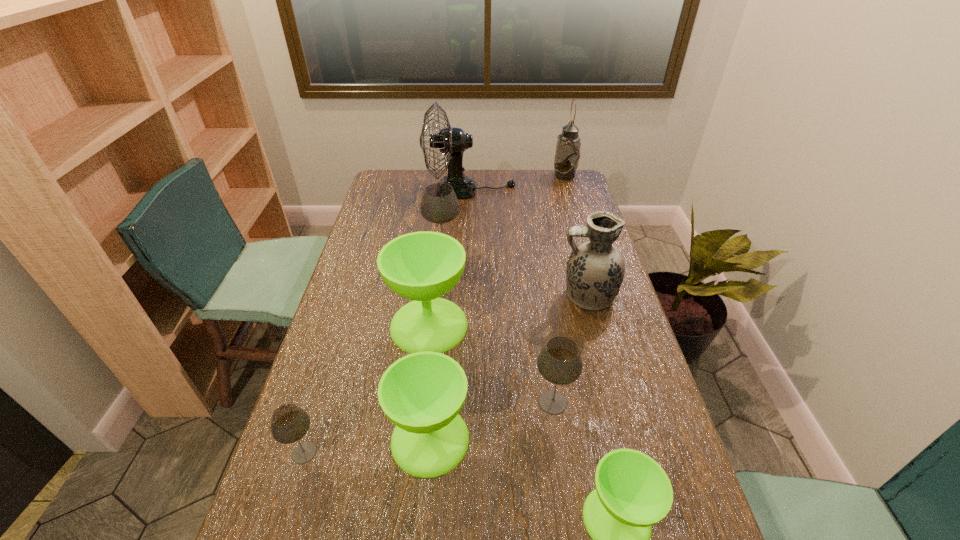
The image size is (960, 540). Find the location of `the leftmost wineglass`. the leftmost wineglass is located at coordinates (289, 423).

Identify the location of the leftmost gray wineglass. (289, 423).

Image resolution: width=960 pixels, height=540 pixels. Identify the location of free location located 0.100m in front of the black fan, indicating the direction of air flow. click(x=540, y=191).

Find the location of a particular element. free space located on the left of the oil lamp is located at coordinates (516, 176).

I want to click on free region located with the handle on the side of the blue vase, so (468, 296).

Where is `vacant space located 0.200m with the handle on the side of the blue vase`? vacant space located 0.200m with the handle on the side of the blue vase is located at coordinates (494, 296).

This screenshot has height=540, width=960. I want to click on vacant space situated with the handle on the side of the blue vase, so click(x=481, y=296).

Where is `free region located 0.170m on the left of the third farthest object`? The width and height of the screenshot is (960, 540). free region located 0.170m on the left of the third farthest object is located at coordinates (376, 254).

Where is `free space located 0.150m on the right of the biggest green wineglass`? The height and width of the screenshot is (540, 960). free space located 0.150m on the right of the biggest green wineglass is located at coordinates (518, 325).

The height and width of the screenshot is (540, 960). I want to click on vacant region located 0.160m on the back of the second nearest gray wineglass, so click(x=543, y=338).